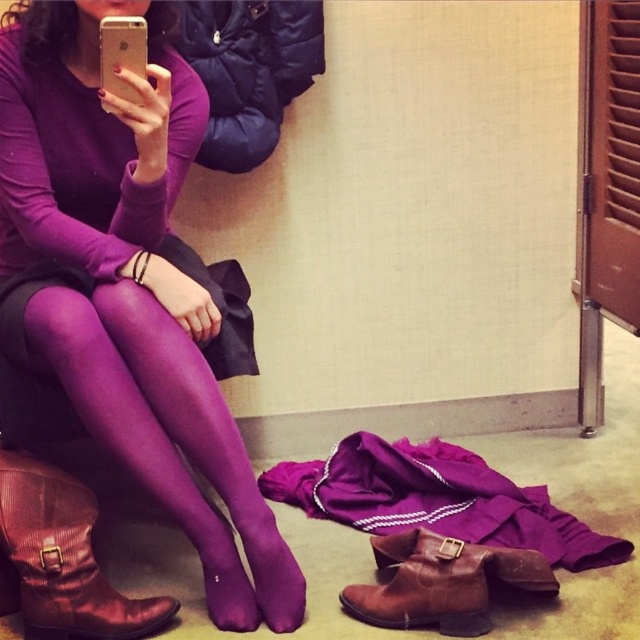
Question: Which object is positioned farthest from the matte purple tights at lower center?

Choices:
 (A) brown suede boot at lower center
 (B) brown leather boot at lower left

Answer: (A)

Question: Is matte purple tights at lower center further to the viewer compared to brown leather boot at lower left?

Choices:
 (A) no
 (B) yes

Answer: (A)

Question: Which point is farther to the camera?

Choices:
 (A) (445, 628)
 (B) (134, 358)

Answer: (B)

Question: Can you confirm if brown leather boot at lower left is wider than brown suede boot at lower center?

Choices:
 (A) yes
 (B) no

Answer: (B)

Question: Which object is the closest to the matte purple tights at lower center?

Choices:
 (A) brown suede boot at lower center
 (B) brown leather boot at lower left

Answer: (B)

Question: In this image, where is brown leather boot at lower left located relative to brown suede boot at lower center?

Choices:
 (A) below
 (B) above

Answer: (B)